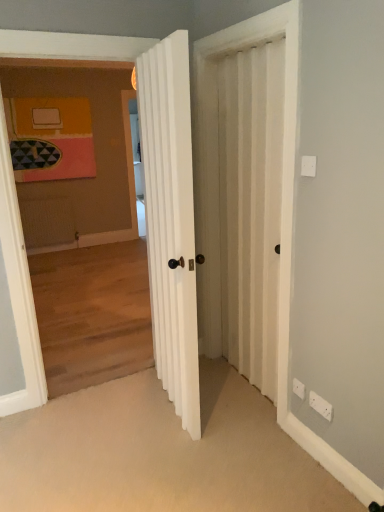
Question: Is white ribbed door at center wider or thinner than white plastic electric outlet at lower right, which is counted as the 1th electric outlet, starting from the back?

Choices:
 (A) thin
 (B) wide

Answer: (B)

Question: Is white ribbed door at center spatially inside white plastic electric outlet at lower right, acting as the 2th electric outlet starting from the front, or outside of it?

Choices:
 (A) outside
 (B) inside

Answer: (A)

Question: Estimate the real-world distances between objects in this image. Which object is farther from the white ribbed door at center?

Choices:
 (A) white textured screen door at center
 (B) white plastic electric outlet at lower right, which appears as the second electric outlet when viewed from the back
 (C) white plastic electric outlet at lower right, the 1th electric outlet from the left

Answer: (B)

Question: Estimate the real-world distances between objects in this image. Which object is farther from the white ribbed door at center?

Choices:
 (A) white plastic electric outlet at lower right, the second electric outlet when ordered from left to right
 (B) white plastic electric outlet at lower right, the 1th electric outlet from the left
 (C) white textured screen door at center

Answer: (A)